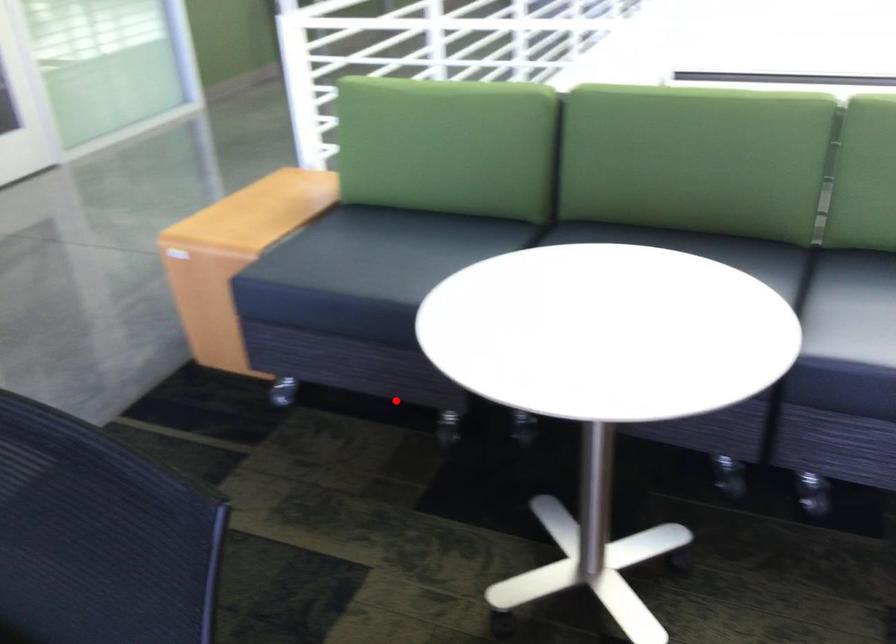
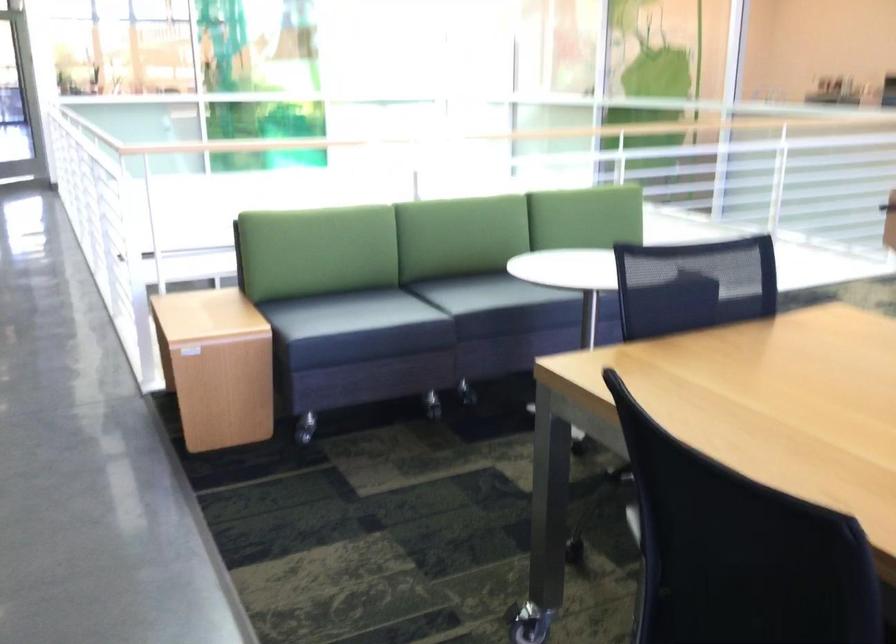
Question: I am providing you with two images of the same scene from different viewpoints. In image1, a red point is highlighted. Considering the same 3D point in image2, which of the following is correct?

Choices:
 (A) It is closer
 (B) It is farther

Answer: (B)